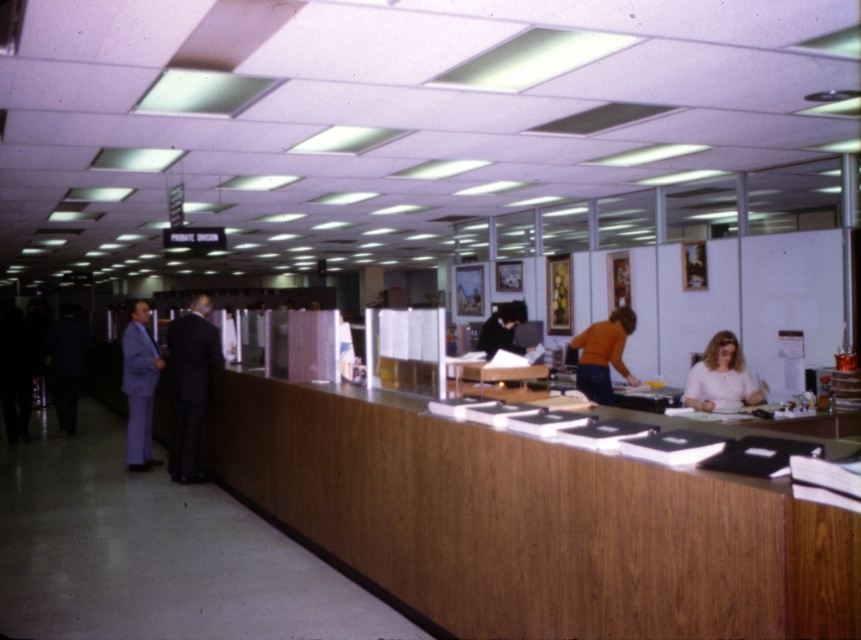
You are standing at the entrance of the office and see a light purple suit at left and an orange sweater at center. Which one is closer to you?

The light purple suit at left is closer to you since it is 4.09 meters away from the orange sweater at center, meaning the orange sweater is further away.

You are an office worker who needs to place a 1.2 meter wide document on the wooden counter at center. The dark suit at center is currently occupying part of the counter. Can the document fit on the remaining space?

The wooden counter at center might be wider than dark suit at center, so there could be enough space for the 1.2 meter wide document if the counter extends beyond the dark suit. However, without exact measurements, it is uncertain.

Consider the image. You are an office worker who needs to place a 1.2 meter wide box on the wooden counter at center. The light purple suit at left is currently on the counter. Can the box fit on the counter if you move the suit?

The wooden counter at center might be wider than light purple suit at left, so if you move the light purple suit at left off the counter, there might be enough space to place the 1.2 meter wide box on the wooden counter at center.